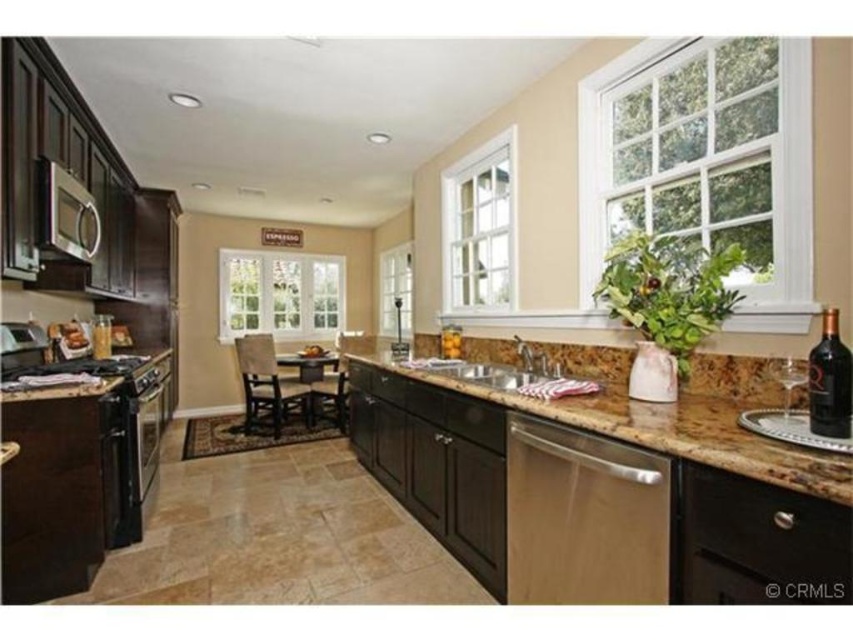
Question: Is white wood window at upper right to the left of white glass window at upper right from the viewer's perspective?

Choices:
 (A) yes
 (B) no

Answer: (B)

Question: Where is white wood window at upper right located in relation to brown granite sink at center in the image?

Choices:
 (A) below
 (B) above

Answer: (B)

Question: Which point appears farthest from the camera in this image?

Choices:
 (A) (755, 385)
 (B) (403, 250)
 (C) (106, 353)
 (D) (454, 248)

Answer: (B)

Question: From the image, what is the correct spatial relationship of light brown fabric chair at center in relation to dark glass bottle at right?

Choices:
 (A) left
 (B) right

Answer: (A)

Question: Which object appears farthest from the camera in this image?

Choices:
 (A) clear glass windows at center
 (B) satin silver microwave at upper left
 (C) brown granite sink at center
 (D) stainless steel sink at center

Answer: (A)

Question: Which of the following is the closest to the observer?

Choices:
 (A) stainless steel sink at center
 (B) clear glass windows at center

Answer: (A)